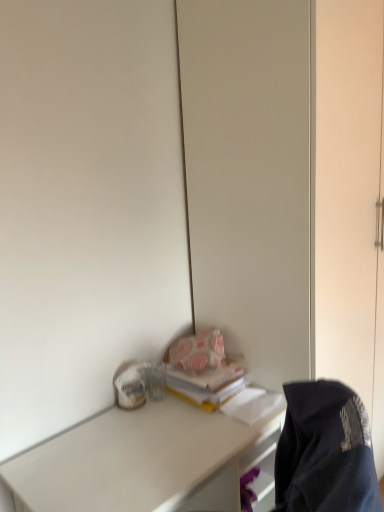
Question: Does white matte desk at lower left have a lesser height compared to dark blue fabric jacket at lower right?

Choices:
 (A) no
 (B) yes

Answer: (A)

Question: Is dark blue fabric jacket at lower right at the back of white matte desk at lower left?

Choices:
 (A) no
 (B) yes

Answer: (A)

Question: Considering the relative sizes of white matte desk at lower left and dark blue fabric jacket at lower right in the image provided, is white matte desk at lower left bigger than dark blue fabric jacket at lower right?

Choices:
 (A) yes
 (B) no

Answer: (A)

Question: Does white matte desk at lower left have a greater width compared to dark blue fabric jacket at lower right?

Choices:
 (A) yes
 (B) no

Answer: (A)

Question: Is white matte desk at lower left at the left side of dark blue fabric jacket at lower right?

Choices:
 (A) yes
 (B) no

Answer: (A)

Question: Is point (228, 393) positioned closer to the camera than point (299, 467)?

Choices:
 (A) farther
 (B) closer

Answer: (A)

Question: In terms of size, does yellow matte book at center appear bigger or smaller than dark blue fabric jacket at lower right?

Choices:
 (A) big
 (B) small

Answer: (B)

Question: Considering the positions of yellow matte book at center and dark blue fabric jacket at lower right in the image, is yellow matte book at center taller or shorter than dark blue fabric jacket at lower right?

Choices:
 (A) tall
 (B) short

Answer: (B)

Question: From the image's perspective, is yellow matte book at center located above or below dark blue fabric jacket at lower right?

Choices:
 (A) below
 (B) above

Answer: (B)

Question: Considering the positions of white matte desk at lower left and yellow matte book at center in the image, is white matte desk at lower left wider or thinner than yellow matte book at center?

Choices:
 (A) wide
 (B) thin

Answer: (A)

Question: From a real-world perspective, is white matte desk at lower left above or below yellow matte book at center?

Choices:
 (A) above
 (B) below

Answer: (B)

Question: Based on their sizes in the image, would you say white matte desk at lower left is bigger or smaller than yellow matte book at center?

Choices:
 (A) big
 (B) small

Answer: (A)

Question: In the image, is white matte desk at lower left on the left side or the right side of yellow matte book at center?

Choices:
 (A) right
 (B) left

Answer: (B)

Question: From the image's perspective, is dark blue fabric jacket at lower right above or below yellow matte book at center?

Choices:
 (A) above
 (B) below

Answer: (B)

Question: From a real-world perspective, is dark blue fabric jacket at lower right positioned above or below yellow matte book at center?

Choices:
 (A) below
 (B) above

Answer: (A)